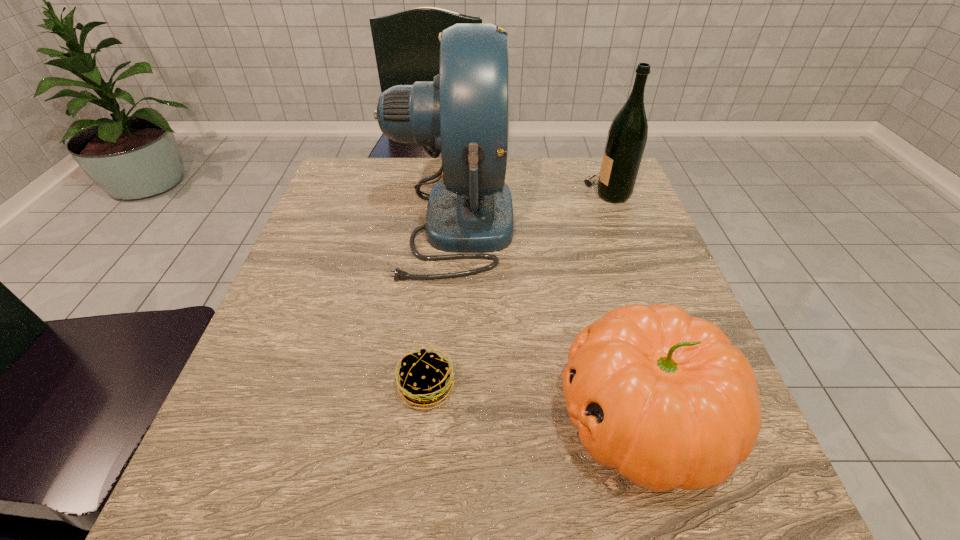
Where is `free point between the wine bottle and the shortest object`? This screenshot has height=540, width=960. free point between the wine bottle and the shortest object is located at coordinates (517, 290).

Find the location of a particular element. This screenshot has height=540, width=960. free space between the wine bottle and the tallest object is located at coordinates (530, 208).

Identify the location of empty location between the pumpkin and the shortest object. The height and width of the screenshot is (540, 960). pos(535,402).

Image resolution: width=960 pixels, height=540 pixels. Identify the location of object that can be found as the third closest to the shortest object. (627, 136).

Point out which object is positioned as the nearest to the shortest object. Please provide its 2D coordinates. Your answer should be formatted as a tuple, i.e. [(x, y)], where the tuple contains the x and y coordinates of a point satisfying the conditions above.

[(665, 398)]

The image size is (960, 540). Identify the location of vacant point that satisfies the following two spatial constraints: 1. in front of the tallest object to blow air; 2. on the front side of the patty. (440, 387).

Identify the location of vacant position in the image that satisfies the following two spatial constraints: 1. on the front side of the second tallest object; 2. on the carved face of the second shortest object. This screenshot has width=960, height=540. (691, 416).

Find the location of a particular element. free space that satisfies the following two spatial constraints: 1. on the back side of the wine bottle; 2. on the left side of the shortest object is located at coordinates (446, 193).

Locate an element on the screen. The image size is (960, 540). vacant point that satisfies the following two spatial constraints: 1. on the front side of the wine bottle; 2. in front of the fan to blow air is located at coordinates (619, 224).

You are a GUI agent. You are given a task and a screenshot of the screen. Output one action in this format:
    pyautogui.click(x=<x>, y=<y>)
    Task: Click on the free location that satisfies the following two spatial constraints: 1. in front of the tallest object to blow air; 2. on the front side of the shortest object
    
    Given the screenshot: What is the action you would take?
    pyautogui.click(x=440, y=387)